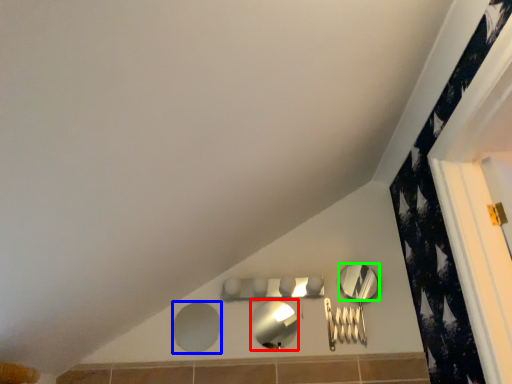
Question: Which object is positioned closest to mirror (highlighted by a red box)? Select from mirror (highlighted by a blue box) and mirror (highlighted by a green box).

Choices:
 (A) mirror
 (B) mirror

Answer: (A)